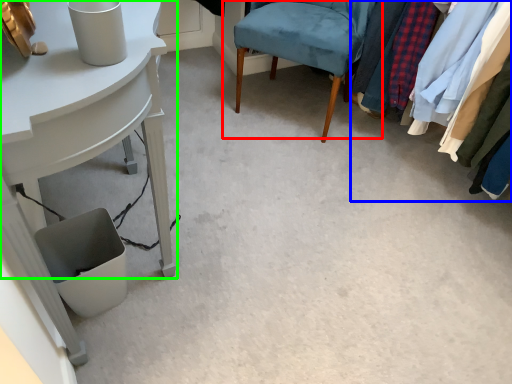
Question: Which object is positioned farthest from chair (highlighted by a red box)? Select from closet (highlighted by a blue box) and table (highlighted by a green box).

Choices:
 (A) closet
 (B) table

Answer: (B)